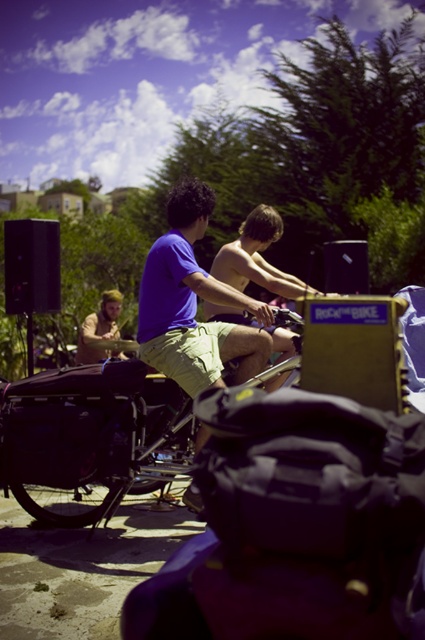
You are planning to place a new bench in the outdoor scene. The bench will be positioned at coordinates point A. To ensure it doesn not block the view of the matte black bicycle at center, where should point A be located relative to the bicycle?

The bench should be placed at coordinates that do not obstruct the view of the matte black bicycle at center. Since the bicycle is located at point A, the bench should be positioned in a way that does not block the line of sight to it. However, without specific coordinates for point A, an exact placement cannot be determined. Please provide the coordinates of point A to determine the best location.

You are planning to place a new bench in the outdoor scene. The bench will be placed at coordinate point 0.686, 0.214. According to the scene description, will the bench overlap with the matte black bicycle at center?

The position of matte black bicycle at center is at point (90, 438), so placing the bench at that coordinate will overlap with the matte black bicycle at center.